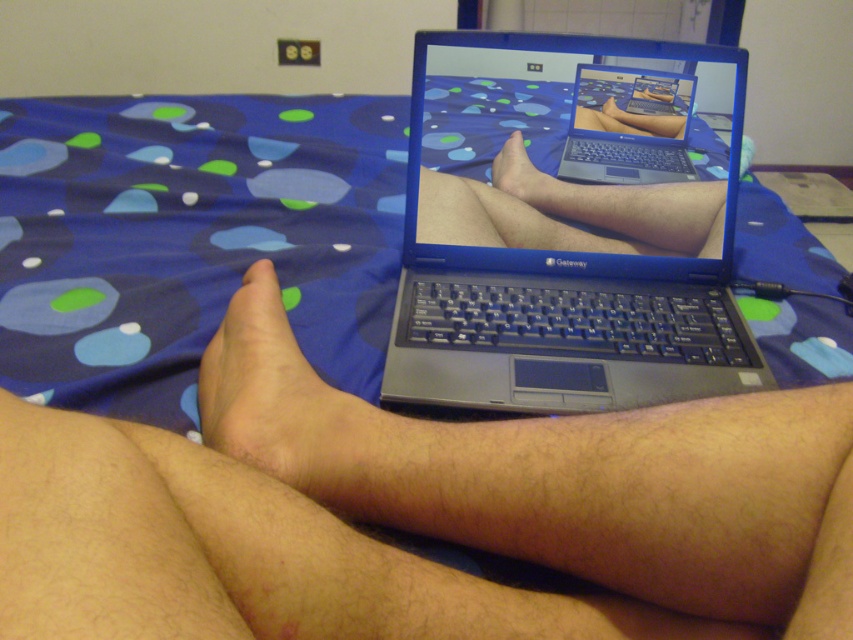
You are a delivery robot that needs to place a small package between the black plastic laptop at center and the smooth skin foot at center. Can you fit the package in that space if the package is 12 centimeters long?

The distance between the black plastic laptop at center and the smooth skin foot at center is 11.85 centimeters. Since the package is 12 centimeters long, it is slightly longer than the available space. Therefore, the package cannot fit in that space.

You are a photographer taking a closeup shot of the bed. You notice the skinny tan skin at center and the smooth skin foot at center. Which one takes up more space in the photo?

The skinny tan skin at center is bigger than the smooth skin foot at center, so it takes up more space in the photo.

You need to place a small decorative item on the bed between the black plastic laptop at center and the smooth skin foot at center. Based on their widths, which object should you place the item closer to?

The black plastic laptop at center might be wider than the smooth skin foot at center, so you should place the item closer to the smooth skin foot at center to ensure there is enough space.